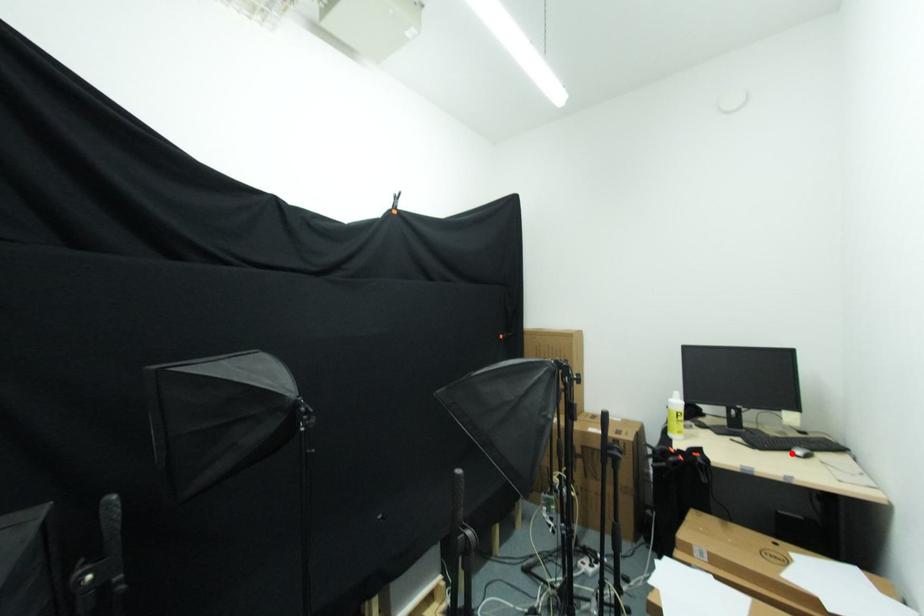
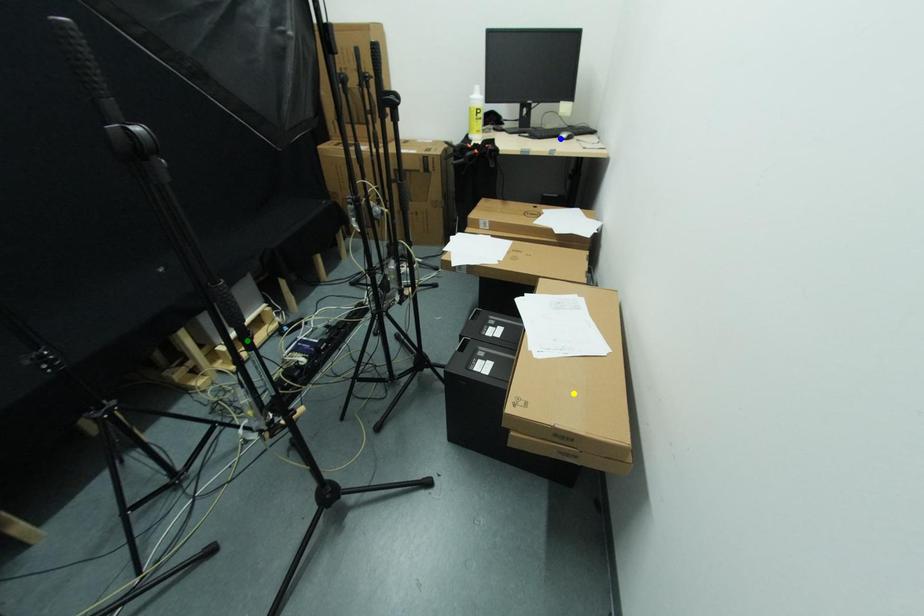
Question: I am providing you with two images of the same scene from different viewpoints. A red point is marked on the first image. You are given multiple points on the second image. Which spot in image 2 lines up with the point in image 1?

Choices:
 (A) blue point
 (B) yellow point
 (C) green point

Answer: (A)